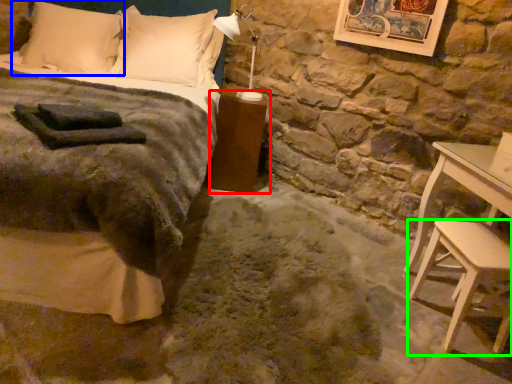
Question: Considering the real-world distances, which object is farthest from nightstand (highlighted by a red box)? pillow (highlighted by a blue box) or stool (highlighted by a green box)?

Choices:
 (A) pillow
 (B) stool

Answer: (B)